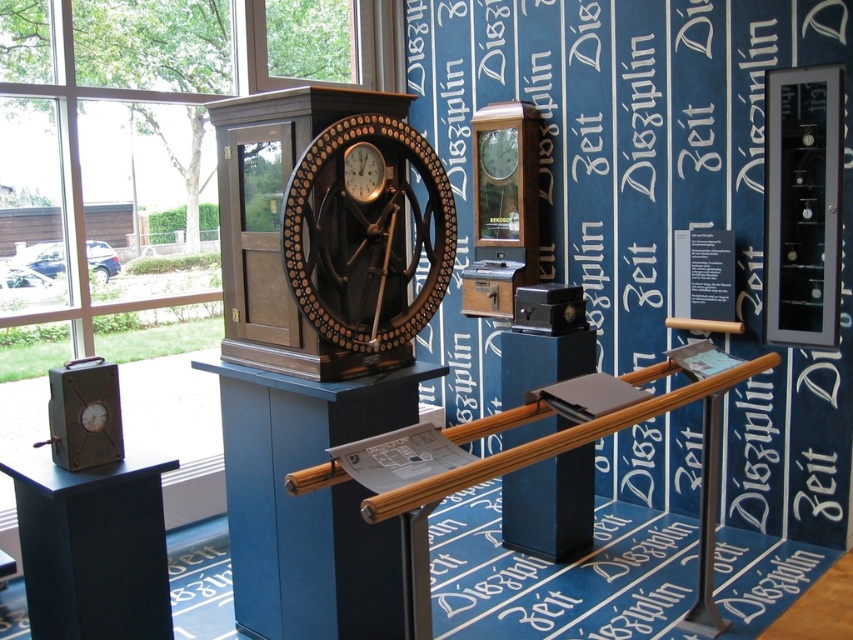
Is point (293, 221) farther from camera compared to point (561, 532)?

No.

Which is below, polished brass clock at center or matte black panel at center?

Positioned lower is matte black panel at center.

Identify the location of polished brass clock at center. (366, 232).

Who is more distant from viewer, (573, 512) or (363, 156)?

Point (573, 512)

Does matte black panel at center have a larger size compared to matte brown clock at center?

Correct, matte black panel at center is larger in size than matte brown clock at center.

The width and height of the screenshot is (853, 640). What do you see at coordinates (550, 506) in the screenshot?
I see `matte black panel at center` at bounding box center [550, 506].

You are a GUI agent. You are given a task and a screenshot of the screen. Output one action in this format:
    pyautogui.click(x=<x>, y=<y>)
    Task: Click on the matte black panel at center
    This screenshot has width=853, height=640.
    Given the screenshot: What is the action you would take?
    (550, 506)

Is blue wood pillar at center to the left of matte brown clock at center from the viewer's perspective?

Correct, you'll find blue wood pillar at center to the left of matte brown clock at center.

Does blue wood pillar at center have a greater height compared to matte brown clock at center?

Yes, blue wood pillar at center is taller than matte brown clock at center.

I want to click on blue wood pillar at center, so click(309, 502).